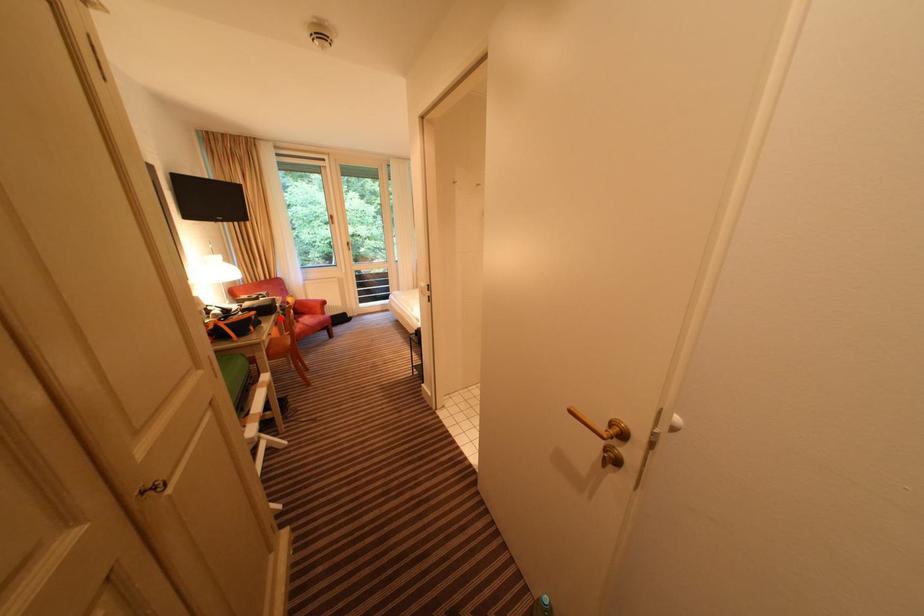
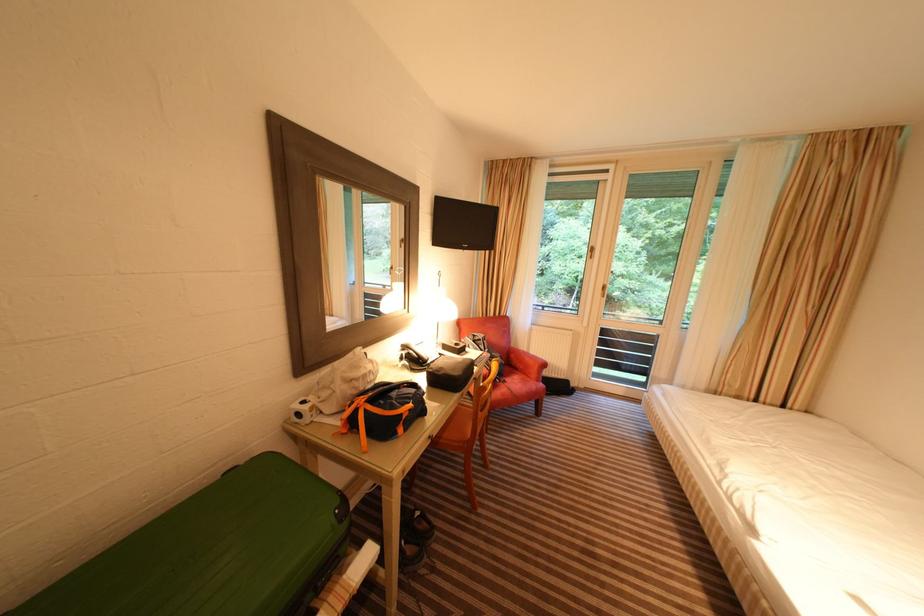
Question: A red point is marked in image1. In image2, is the corresponding 3D point closer to the camera or farther? Reply with the corresponding letter.

Choices:
 (A) The corresponding 3D point is closer.
 (B) The corresponding 3D point is farther.

Answer: (B)